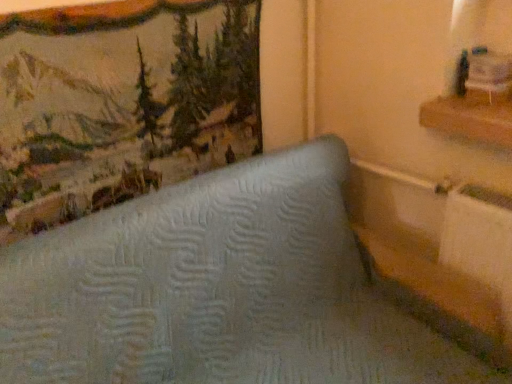
The width and height of the screenshot is (512, 384). I want to click on wooden shelf at upper right, so click(472, 116).

The width and height of the screenshot is (512, 384). What do you see at coordinates (121, 103) in the screenshot?
I see `textured fabric picture frame at upper left` at bounding box center [121, 103].

You are a GUI agent. You are given a task and a screenshot of the screen. Output one action in this format:
    pyautogui.click(x=<x>, y=<y>)
    Task: Click on the light blue quilted mattress at center
    The image size is (512, 384).
    Given the screenshot: What is the action you would take?
    pyautogui.click(x=217, y=290)

This screenshot has height=384, width=512. I want to click on wooden shelf at upper right, so click(472, 116).

Does light blue quilted mattress at center have a larger size compared to wooden shelf at upper right?

Correct, light blue quilted mattress at center is larger in size than wooden shelf at upper right.

Measure the distance from light blue quilted mattress at center to wooden shelf at upper right.

The distance of light blue quilted mattress at center from wooden shelf at upper right is 66.79 centimeters.

Considering the positions of points (228, 373) and (434, 98), is point (228, 373) closer to camera compared to point (434, 98)?

Yes, point (228, 373) is in front of point (434, 98).

Is light blue quilted mattress at center far away from wooden shelf at upper right?

No, light blue quilted mattress at center is not far away from wooden shelf at upper right.

From a real-world perspective, who is located higher, light blue quilted mattress at center or textured fabric picture frame at upper left?

In real-world perspective, textured fabric picture frame at upper left is above.

Could you tell me if light blue quilted mattress at center is facing textured fabric picture frame at upper left?

No, light blue quilted mattress at center is not facing towards textured fabric picture frame at upper left.

Is light blue quilted mattress at center positioned behind textured fabric picture frame at upper left?

That is False.

Considering the sizes of objects light blue quilted mattress at center and textured fabric picture frame at upper left in the image provided, who is bigger, light blue quilted mattress at center or textured fabric picture frame at upper left?

light blue quilted mattress at center is bigger.

From a real-world perspective, relative to wooden shelf at upper right, is textured fabric picture frame at upper left vertically above or below?

From a real-world perspective, textured fabric picture frame at upper left is physically above wooden shelf at upper right.

Could you tell me if textured fabric picture frame at upper left is facing wooden shelf at upper right?

No, textured fabric picture frame at upper left is not oriented towards wooden shelf at upper right.

Is textured fabric picture frame at upper left not within wooden shelf at upper right?

Absolutely, textured fabric picture frame at upper left is external to wooden shelf at upper right.

Locate an element on the screen. The width and height of the screenshot is (512, 384). picture frame above the wooden shelf at upper right (from the image's perspective) is located at coordinates (121, 103).

In the scene shown: From the image's perspective, is wooden shelf at upper right under light blue quilted mattress at center?

No, from the image's perspective, wooden shelf at upper right is not beneath light blue quilted mattress at center.

Would you say wooden shelf at upper right is a long distance from light blue quilted mattress at center?

No, wooden shelf at upper right is in close proximity to light blue quilted mattress at center.

Can you confirm if wooden shelf at upper right is shorter than light blue quilted mattress at center?

Correct, wooden shelf at upper right is not as tall as light blue quilted mattress at center.

Locate an element on the screen. Image resolution: width=512 pixels, height=384 pixels. shelf located above the light blue quilted mattress at center (from the image's perspective) is located at coordinates (472, 116).

Can you confirm if wooden shelf at upper right is wider than textured fabric picture frame at upper left?

Yes.

Based on the photo, from a real-world perspective, is wooden shelf at upper right physically below textured fabric picture frame at upper left?

Yes, from a real-world perspective, wooden shelf at upper right is below textured fabric picture frame at upper left.

Is wooden shelf at upper right bigger than textured fabric picture frame at upper left?

Incorrect, wooden shelf at upper right is not larger than textured fabric picture frame at upper left.

Is textured fabric picture frame at upper left located within wooden shelf at upper right?

No, textured fabric picture frame at upper left is not a part of wooden shelf at upper right.

From a real-world perspective, which is physically above, textured fabric picture frame at upper left or light blue quilted mattress at center?

textured fabric picture frame at upper left, from a real-world perspective.

Image resolution: width=512 pixels, height=384 pixels. I want to click on picture frame that appears on the left of light blue quilted mattress at center, so click(121, 103).

Between textured fabric picture frame at upper left and light blue quilted mattress at center, which one has smaller size?

With smaller size is textured fabric picture frame at upper left.

Locate an element on the screen. This screenshot has width=512, height=384. furniture on the left of the wooden shelf at upper right is located at coordinates (217, 290).

The width and height of the screenshot is (512, 384). I want to click on picture frame above the light blue quilted mattress at center (from a real-world perspective), so click(121, 103).

Looking at the image, which one is located further to textured fabric picture frame at upper left, wooden shelf at upper right or light blue quilted mattress at center?

Based on the image, wooden shelf at upper right appears to be further to textured fabric picture frame at upper left.

From the image, which object appears to be nearer to textured fabric picture frame at upper left, light blue quilted mattress at center or wooden shelf at upper right?

Among the two, light blue quilted mattress at center is located nearer to textured fabric picture frame at upper left.

Looking at the image, which one is located closer to light blue quilted mattress at center, textured fabric picture frame at upper left or wooden shelf at upper right?

textured fabric picture frame at upper left is closer to light blue quilted mattress at center.

Looking at the image, which one is located closer to wooden shelf at upper right, textured fabric picture frame at upper left or light blue quilted mattress at center?

light blue quilted mattress at center is positioned closer to the anchor wooden shelf at upper right.

When comparing their distances from light blue quilted mattress at center, does wooden shelf at upper right or textured fabric picture frame at upper left seem further?

wooden shelf at upper right lies further to light blue quilted mattress at center than the other object.

From the image, which object appears to be nearer to wooden shelf at upper right, light blue quilted mattress at center or textured fabric picture frame at upper left?

light blue quilted mattress at center lies closer to wooden shelf at upper right than the other object.

Identify the location of furniture situated between textured fabric picture frame at upper left and wooden shelf at upper right from left to right. The height and width of the screenshot is (384, 512). (217, 290).